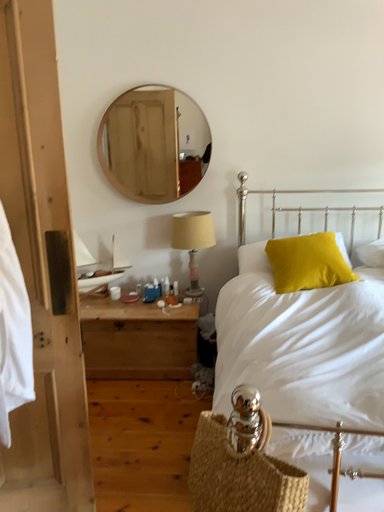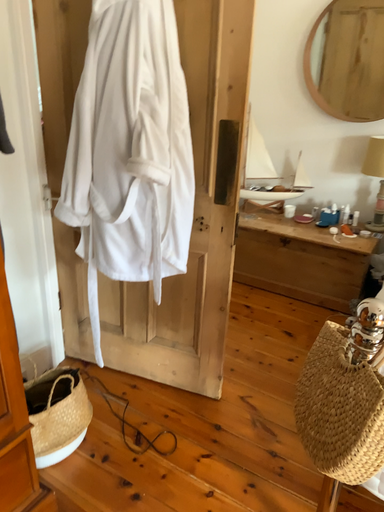
Question: How did the camera likely rotate when shooting the video?

Choices:
 (A) rotated upward
 (B) rotated downward

Answer: (B)